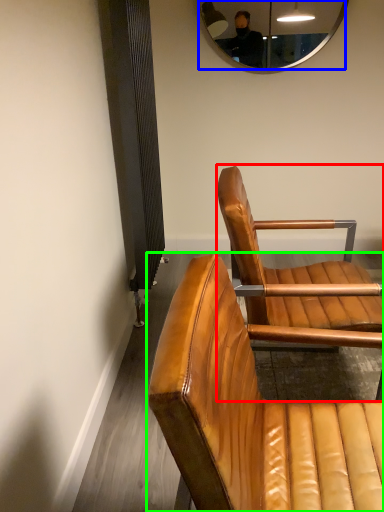
Question: Based on their relative distances, which object is nearer to chair (highlighted by a red box)? Choose from mirror (highlighted by a blue box) and chair (highlighted by a green box).

Choices:
 (A) mirror
 (B) chair

Answer: (B)